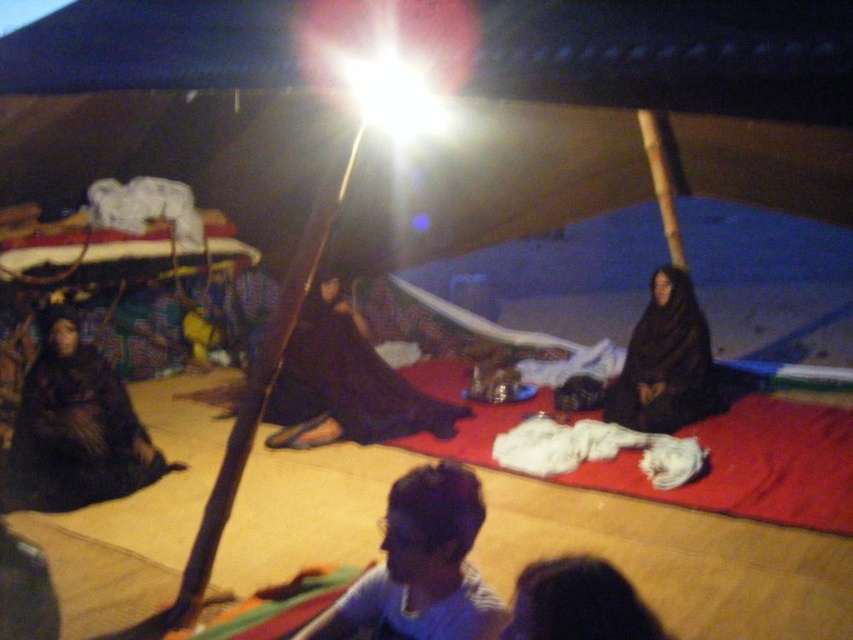
You are a photographer standing outside the tent. You want to take a photo that includes both the black matte dress at left and the black matte dress at center. The camera you have can only focus on objects within a 2.5 meter range. Will both dresses be in focus?

The distance between the black matte dress at left and the black matte dress at center is 3.09 meters. Since the camera can only focus within a 2.5 meter range, the two dresses are too far apart to both be in focus simultaneously.